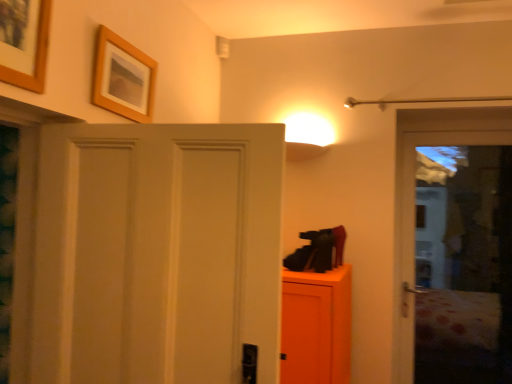
Question: Looking at the image, does wooden picture frame at upper left, positioned as the second picture frame in right-to-left order, seem bigger or smaller compared to wooden frame at upper left, the second picture frame positioned from the left?

Choices:
 (A) big
 (B) small

Answer: (A)

Question: Is wooden picture frame at upper left, which is the 1th picture frame in left-to-right order, to the left or to the right of wooden frame at upper left, which ranks as the first picture frame in back-to-front order, in the image?

Choices:
 (A) left
 (B) right

Answer: (A)

Question: Is wooden picture frame at upper left, placed as the 1th picture frame when sorted from front to back, taller or shorter than wooden frame at upper left, the 2th picture frame from the front?

Choices:
 (A) tall
 (B) short

Answer: (A)

Question: Would you say wooden frame at upper left, arranged as the 1th picture frame when viewed from the right, is inside or outside wooden picture frame at upper left, which is the 1th picture frame in left-to-right order?

Choices:
 (A) inside
 (B) outside

Answer: (B)

Question: From a real-world perspective, is wooden frame at upper left, which ranks as the first picture frame in back-to-front order, above or below wooden picture frame at upper left, placed as the 1th picture frame when sorted from front to back?

Choices:
 (A) below
 (B) above

Answer: (A)

Question: From the image's perspective, is wooden frame at upper left, which ranks as the first picture frame in back-to-front order, positioned above or below wooden picture frame at upper left, positioned as the second picture frame in back-to-front order?

Choices:
 (A) below
 (B) above

Answer: (A)

Question: Is wooden frame at upper left, the 2th picture frame from the front, to the left or to the right of wooden picture frame at upper left, which is the 1th picture frame in left-to-right order, in the image?

Choices:
 (A) right
 (B) left

Answer: (A)